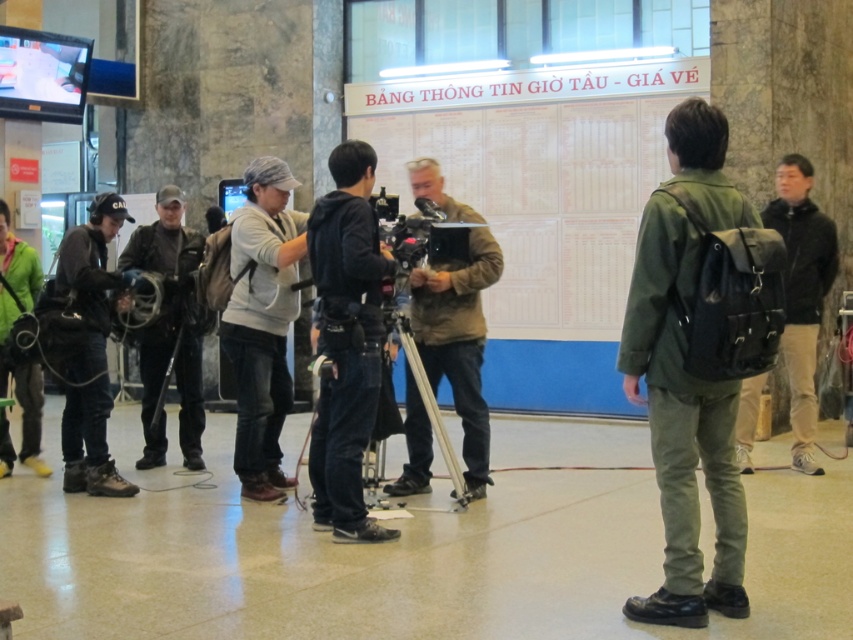
Question: Considering the real-world distances, which object is farthest from the black matte video camera at center?

Choices:
 (A) matte black jacket at left
 (B) brown leather jacket at center

Answer: (A)

Question: Among these objects, which one is farthest from the camera?

Choices:
 (A) black matte video camera at center
 (B) black leather jacket at center
 (C) black matte backpack at right

Answer: (B)

Question: Can you confirm if green canvas backpack at center is smaller than silver metallic tripod at center?

Choices:
 (A) yes
 (B) no

Answer: (B)

Question: From the image, what is the correct spatial relationship of matte black jacket at left in relation to black matte video camera at center?

Choices:
 (A) above
 (B) below

Answer: (B)

Question: Estimate the real-world distances between objects in this image. Which object is farther from the black matte jacket at center?

Choices:
 (A) matte black jacket at left
 (B) black leather jacket at center
 (C) green canvas backpack at center

Answer: (B)

Question: Where is green canvas backpack at center located in relation to brown leather jacket at center in the image?

Choices:
 (A) left
 (B) right

Answer: (B)